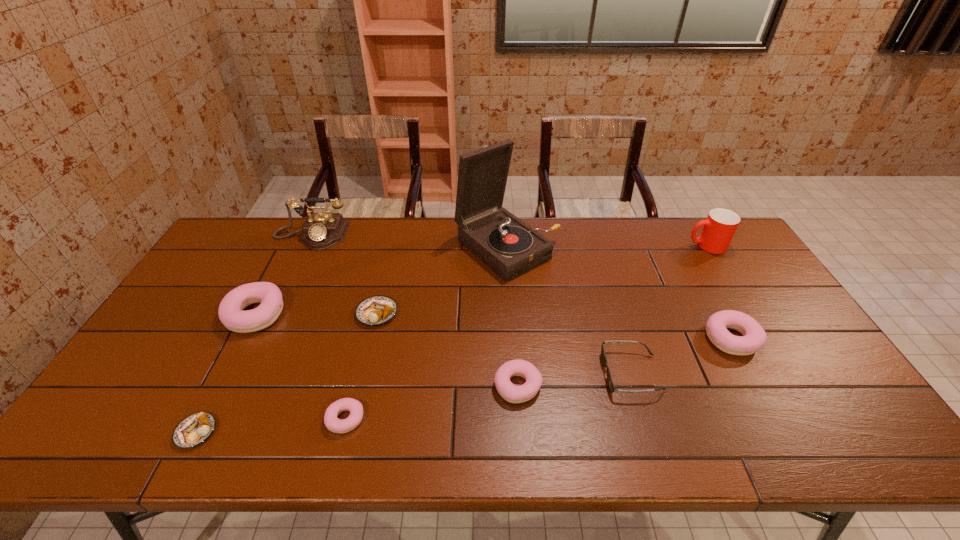
The image size is (960, 540). Find the location of `vacant space that satisfies the following two spatial constraints: 1. on the dial of the tallest object; 2. on the right side of the black telephone`. vacant space that satisfies the following two spatial constraints: 1. on the dial of the tallest object; 2. on the right side of the black telephone is located at coordinates (305, 248).

Identify the location of free spot that satisfies the following two spatial constraints: 1. on the back side of the third pink pastry from right to left; 2. on the left side of the phonograph record. (388, 248).